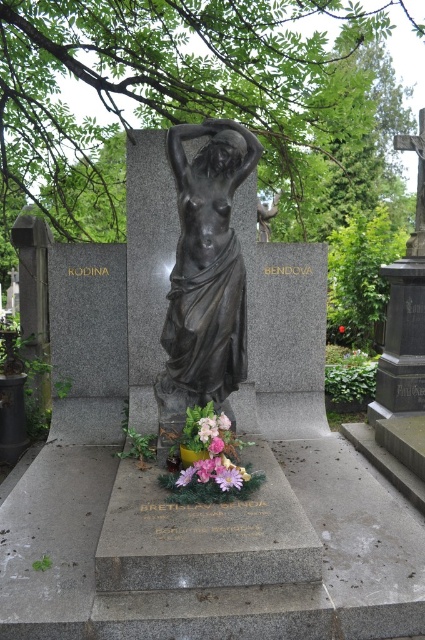
Does purple matte flower at center have a greater height compared to pink matte flower at center?

Indeed, purple matte flower at center has a greater height compared to pink matte flower at center.

Who is more distant from viewer, (217, 476) or (343, 326)?

Positioned behind is point (343, 326).

This screenshot has width=425, height=640. Identify the location of purple matte flower at center. [229, 477].

Does pink floral bouquet at center have a larger size compared to purple matte flower at center?

Yes.

Does point (207, 451) come closer to viewer compared to point (224, 490)?

No, (207, 451) is further to viewer.

Where is `pink floral bouquet at center`? pink floral bouquet at center is located at coordinates (209, 451).

Does bronze statue at center appear over pink floral bouquet at center?

Correct, bronze statue at center is located above pink floral bouquet at center.

In the scene shown: Can you confirm if bronze statue at center is wider than pink floral bouquet at center?

Yes, bronze statue at center is wider than pink floral bouquet at center.

Is point (209, 353) positioned in front of point (195, 448)?

No, it is behind (195, 448).

Identify the location of bronze statue at center. This screenshot has height=640, width=425. (207, 264).